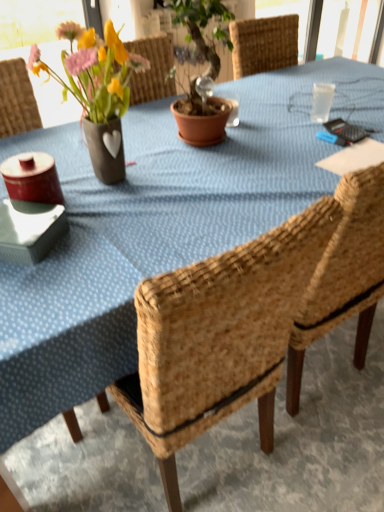
This screenshot has height=512, width=384. What are the coordinates of `spots to the right of matte ceramic vase at upper left` in the screenshot? It's located at (200, 181).